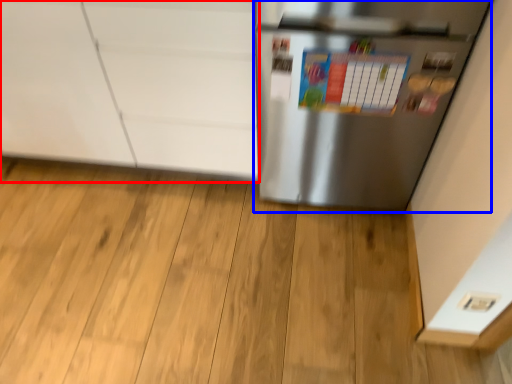
Question: Among these objects, which one is farthest to the camera, cabinetry (highlighted by a red box) or refrigerator (highlighted by a blue box)?

Choices:
 (A) cabinetry
 (B) refrigerator

Answer: (A)